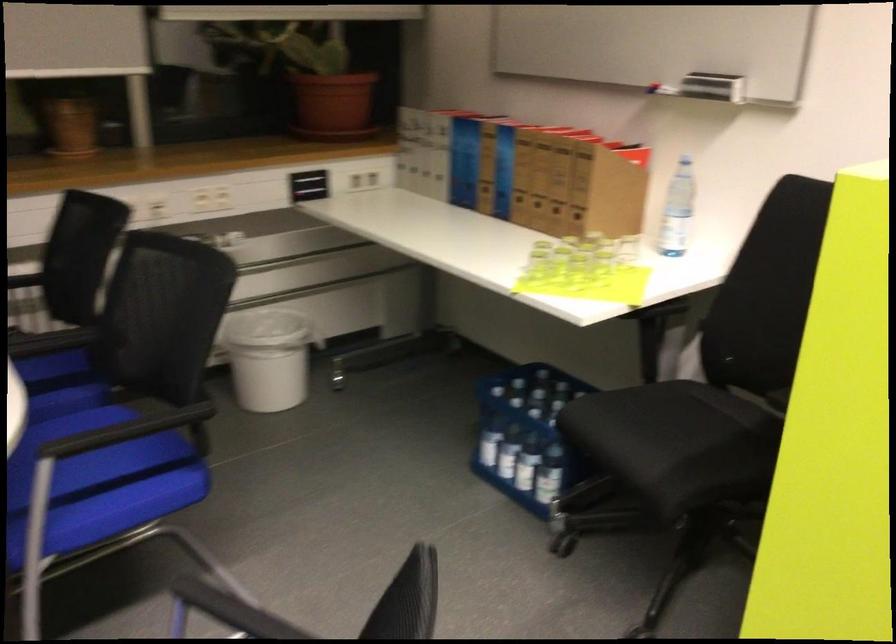
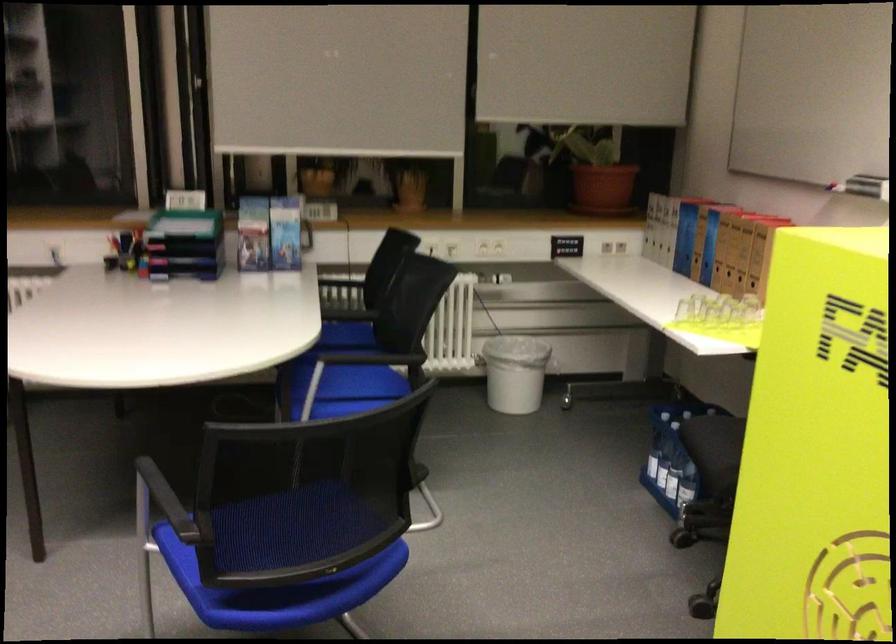
In the second image, find the point that corresponds to the point at 85,451 in the first image.

(349, 382)